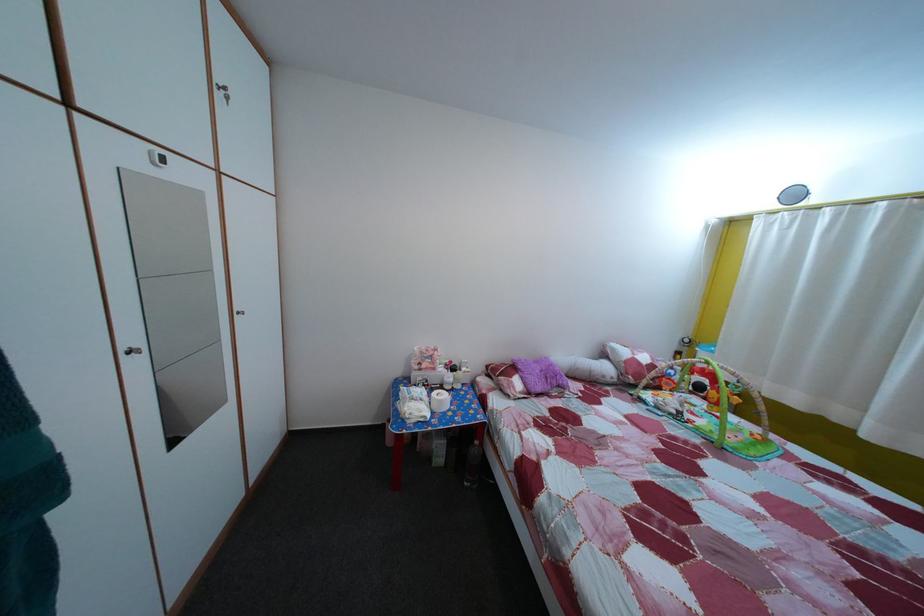
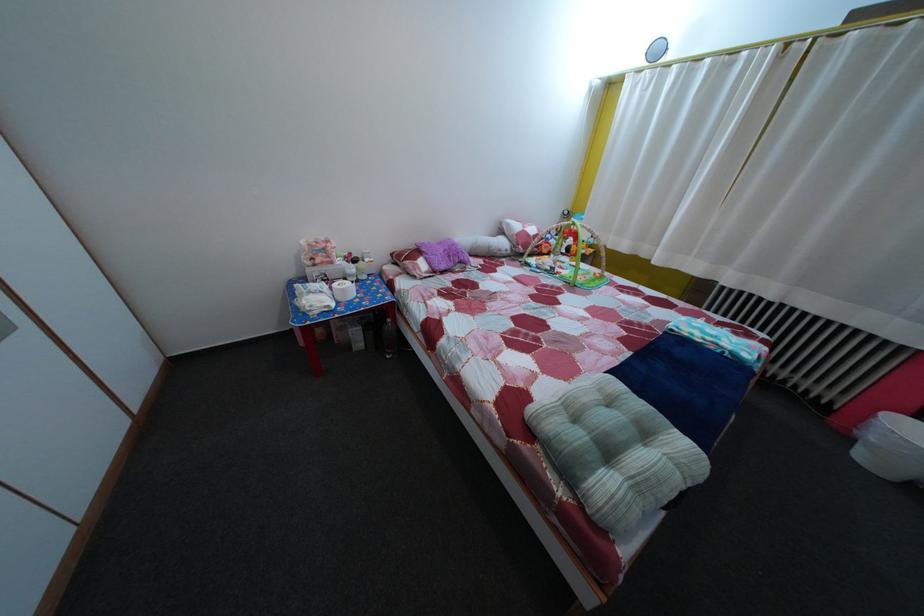
Based on the continuous images, in which direction is the camera rotating?

The rotation direction of the camera is right-down.